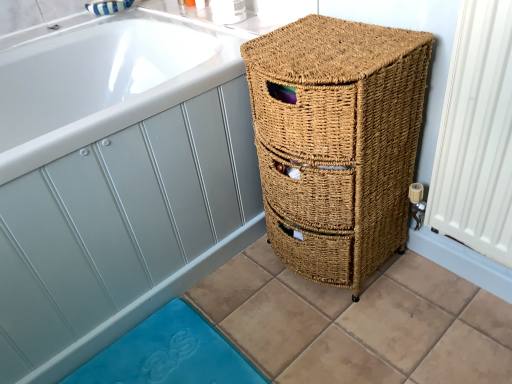
The image size is (512, 384). Find the location of `natural woven basket at right`. natural woven basket at right is located at coordinates (116, 180).

The image size is (512, 384). Identify the location of natural woven basket at right. (337, 141).

Where is `natural woven basket at right`? The height and width of the screenshot is (384, 512). natural woven basket at right is located at coordinates (116, 180).

Which of these two, blue rubber bath mat at lower left or natural woven basket at right, is smaller?

Smaller between the two is blue rubber bath mat at lower left.

Would you consider blue rubber bath mat at lower left to be distant from natural woven basket at right?

No, there isn't a large distance between blue rubber bath mat at lower left and natural woven basket at right.

Is blue rubber bath mat at lower left completely or partially outside of natural woven basket at right?

Yes, blue rubber bath mat at lower left is outside of natural woven basket at right.

Which of these two, blue rubber bath mat at lower left or natural woven basket at right, is thinner?

blue rubber bath mat at lower left.

From the picture: Does natural woven basket at right have a larger size compared to blue rubber bath mat at lower left?

Yes.

Is natural woven basket at right thinner than blue rubber bath mat at lower left?

In fact, natural woven basket at right might be wider than blue rubber bath mat at lower left.

Is natural woven basket at right to the left or to the right of blue rubber bath mat at lower left in the image?

natural woven basket at right is positioned on blue rubber bath mat at lower left's left side.

Does point (202, 60) come farther from viewer compared to point (182, 308)?

That is False.

Is natural woven basket at right wider than natural woven basket at right?

Incorrect, the width of natural woven basket at right does not surpass that of natural woven basket at right.

Could you tell me if natural woven basket at right is facing natural woven basket at right?

No.

Who is taller, natural woven basket at right or natural woven basket at right?

Standing taller between the two is natural woven basket at right.

Considering the sizes of objects natural woven basket at right and natural woven basket at right in the image provided, who is shorter, natural woven basket at right or natural woven basket at right?

natural woven basket at right.

From the image's perspective, is natural woven basket at right on natural woven basket at right?

Indeed, from the image's perspective, natural woven basket at right is shown above natural woven basket at right.

Considering the relative positions of natural woven basket at right and natural woven basket at right in the image provided, is natural woven basket at right behind natural woven basket at right?

No, the depth of natural woven basket at right is less than that of natural woven basket at right.

Is blue rubber bath mat at lower left at the back of natural woven basket at right?

No, natural woven basket at right is not facing away from blue rubber bath mat at lower left.

Can you see natural woven basket at right touching blue rubber bath mat at lower left?

No, natural woven basket at right is not next to blue rubber bath mat at lower left.

In terms of size, does natural woven basket at right appear bigger or smaller than blue rubber bath mat at lower left?

Clearly, natural woven basket at right is larger in size than blue rubber bath mat at lower left.

How far apart are natural woven basket at right and blue rubber bath mat at lower left?

natural woven basket at right is 18.84 inches from blue rubber bath mat at lower left.

Is blue rubber bath mat at lower left aimed at natural woven basket at right?

No.

From their relative heights in the image, would you say blue rubber bath mat at lower left is taller or shorter than natural woven basket at right?

blue rubber bath mat at lower left is shorter than natural woven basket at right.

From a real-world perspective, is blue rubber bath mat at lower left located higher than natural woven basket at right?

No.

Considering the relative sizes of blue rubber bath mat at lower left and natural woven basket at right in the image provided, is blue rubber bath mat at lower left smaller than natural woven basket at right?

Yes.

Where is `bath mat below the natural woven basket at right (from the image's perspective)`? Image resolution: width=512 pixels, height=384 pixels. bath mat below the natural woven basket at right (from the image's perspective) is located at coordinates (169, 354).

The height and width of the screenshot is (384, 512). What are the coordinates of `bath lying in front of the blue rubber bath mat at lower left` in the screenshot? It's located at (116, 180).

Estimate the real-world distances between objects in this image. Which object is further from blue rubber bath mat at lower left, natural woven basket at right or natural woven basket at right?

Based on the image, natural woven basket at right appears to be further to blue rubber bath mat at lower left.

Estimate the real-world distances between objects in this image. Which object is further from natural woven basket at right, blue rubber bath mat at lower left or natural woven basket at right?

Based on the image, blue rubber bath mat at lower left appears to be further to natural woven basket at right.

Considering their positions, is blue rubber bath mat at lower left positioned further to natural woven basket at right than natural woven basket at right?

blue rubber bath mat at lower left is positioned further to the anchor natural woven basket at right.

Based on their spatial positions, is natural woven basket at right or blue rubber bath mat at lower left further from natural woven basket at right?

Based on the image, blue rubber bath mat at lower left appears to be further to natural woven basket at right.

Estimate the real-world distances between objects in this image. Which object is further from natural woven basket at right, natural woven basket at right or blue rubber bath mat at lower left?

blue rubber bath mat at lower left.

In the scene shown: Considering their positions, is natural woven basket at right positioned further to blue rubber bath mat at lower left than natural woven basket at right?

The object further to blue rubber bath mat at lower left is natural woven basket at right.

This screenshot has width=512, height=384. I want to click on bath mat situated between natural woven basket at right and natural woven basket at right from left to right, so click(169, 354).